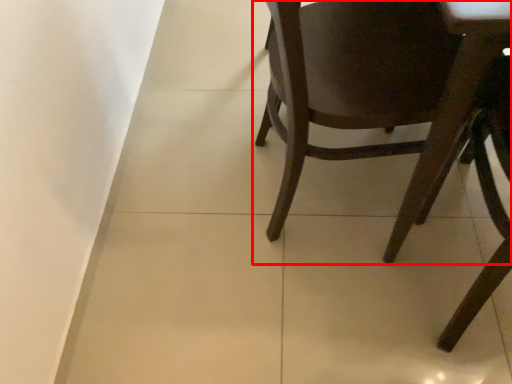
Question: Considering the relative positions of chair (annotated by the red box) and chair in the image provided, where is chair (annotated by the red box) located with respect to the staircase?

Choices:
 (A) left
 (B) right

Answer: (A)